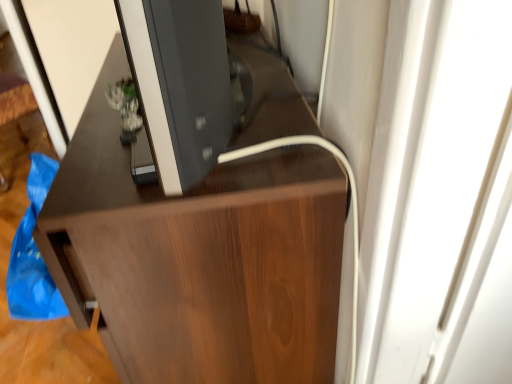
At what (x,y) coordinates should I click in order to perform the action: click on brown wood cabinet at center. Please return your answer as a coordinate pair (x, y). The width and height of the screenshot is (512, 384). Looking at the image, I should click on (198, 258).

This screenshot has width=512, height=384. Describe the element at coordinates (198, 258) in the screenshot. I see `brown wood cabinet at center` at that location.

Where is `brown wood cabinet at center`? Image resolution: width=512 pixels, height=384 pixels. brown wood cabinet at center is located at coordinates (198, 258).